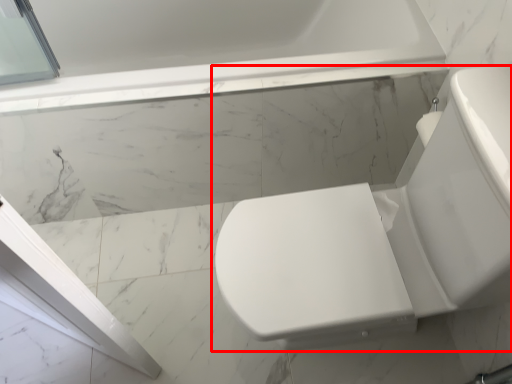
Question: From the image, what is the correct spatial relationship of toilet (annotated by the red box) in relation to bathtub?

Choices:
 (A) right
 (B) left

Answer: (A)